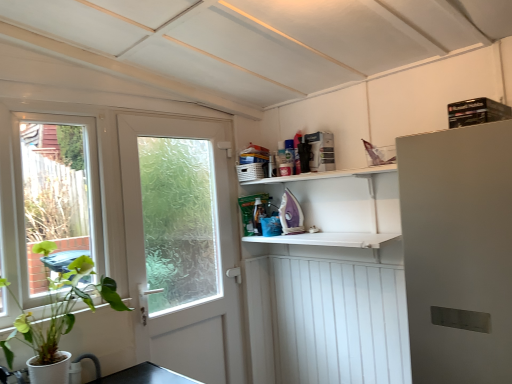
Question: Considering the relative sizes of white matte door at left and white wooden radiator at lower right in the image provided, is white matte door at left wider than white wooden radiator at lower right?

Choices:
 (A) yes
 (B) no

Answer: (B)

Question: Does white matte door at left have a larger size compared to white wooden radiator at lower right?

Choices:
 (A) no
 (B) yes

Answer: (A)

Question: Is white matte door at left at the left side of white wooden radiator at lower right?

Choices:
 (A) yes
 (B) no

Answer: (A)

Question: Is white matte door at left not close to white wooden radiator at lower right?

Choices:
 (A) no
 (B) yes

Answer: (A)

Question: From a real-world perspective, is white matte door at left positioned under white wooden radiator at lower right based on gravity?

Choices:
 (A) yes
 (B) no

Answer: (B)

Question: Is white wooden radiator at lower right at the back of white matte door at left?

Choices:
 (A) no
 (B) yes

Answer: (A)

Question: Could you tell me if white wooden radiator at lower right is turned towards white matte door at left?

Choices:
 (A) no
 (B) yes

Answer: (A)

Question: Are white wooden radiator at lower right and white matte door at left located far from each other?

Choices:
 (A) no
 (B) yes

Answer: (A)

Question: Considering the relative sizes of white wooden radiator at lower right and white matte door at left in the image provided, is white wooden radiator at lower right taller than white matte door at left?

Choices:
 (A) no
 (B) yes

Answer: (B)

Question: Is white wooden radiator at lower right at the right side of white matte door at left?

Choices:
 (A) no
 (B) yes

Answer: (B)

Question: Is the position of white wooden radiator at lower right less distant than that of white matte door at left?

Choices:
 (A) yes
 (B) no

Answer: (B)

Question: From a real-world perspective, does white wooden radiator at lower right stand above white matte door at left?

Choices:
 (A) no
 (B) yes

Answer: (A)

Question: Looking at their shapes, would you say white matte door at left is wider or thinner than white wooden radiator at lower right?

Choices:
 (A) wide
 (B) thin

Answer: (B)